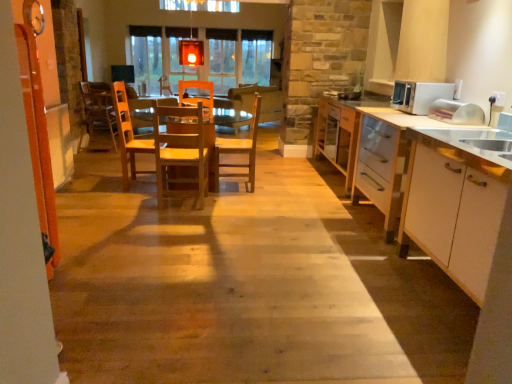
Question: Could you tell me if white glossy cabinet at right is facing translucent glass lantern at upper center?

Choices:
 (A) yes
 (B) no

Answer: (B)

Question: From a real-world perspective, is white glossy cabinet at right over translucent glass lantern at upper center?

Choices:
 (A) no
 (B) yes

Answer: (A)

Question: Can you confirm if white glossy cabinet at right is wider than translucent glass lantern at upper center?

Choices:
 (A) yes
 (B) no

Answer: (A)

Question: Can you confirm if white glossy cabinet at right is taller than translucent glass lantern at upper center?

Choices:
 (A) no
 (B) yes

Answer: (B)

Question: Is white glossy cabinet at right behind translucent glass lantern at upper center?

Choices:
 (A) yes
 (B) no

Answer: (B)

Question: Is wooden floor at center inside the boundaries of wooden chair at center, acting as the third chair starting from the back, or outside?

Choices:
 (A) outside
 (B) inside

Answer: (A)

Question: Is wooden floor at center taller or shorter than wooden chair at center, the 2th chair positioned from the left?

Choices:
 (A) tall
 (B) short

Answer: (B)

Question: Considering the relative positions of wooden floor at center and wooden chair at center, the 2th chair positioned from the left, in the image provided, is wooden floor at center to the left or to the right of wooden chair at center, the 2th chair positioned from the left,?

Choices:
 (A) left
 (B) right

Answer: (B)

Question: Based on their sizes in the image, would you say wooden floor at center is bigger or smaller than wooden chair at center, which ranks as the 1th chair in front-to-back order?

Choices:
 (A) small
 (B) big

Answer: (B)

Question: Considering the positions of wooden chair at center, which is counted as the third chair, starting from the right, and white glossy microwave at right in the image, is wooden chair at center, which is counted as the third chair, starting from the right, taller or shorter than white glossy microwave at right?

Choices:
 (A) short
 (B) tall

Answer: (B)

Question: From a real-world perspective, relative to white glossy microwave at right, is wooden chair at center, the first chair in the back-to-front sequence, vertically above or below?

Choices:
 (A) above
 (B) below

Answer: (B)

Question: Is point (108, 89) positioned closer to the camera than point (408, 107)?

Choices:
 (A) closer
 (B) farther

Answer: (B)

Question: In terms of width, does wooden chair at center, the first chair when ordered from left to right, look wider or thinner when compared to white glossy microwave at right?

Choices:
 (A) wide
 (B) thin

Answer: (A)

Question: Relative to white glossy cabinet at right, is wooden table at center in front or behind?

Choices:
 (A) behind
 (B) front

Answer: (A)

Question: From the image's perspective, is wooden table at center above or below white glossy cabinet at right?

Choices:
 (A) below
 (B) above

Answer: (B)